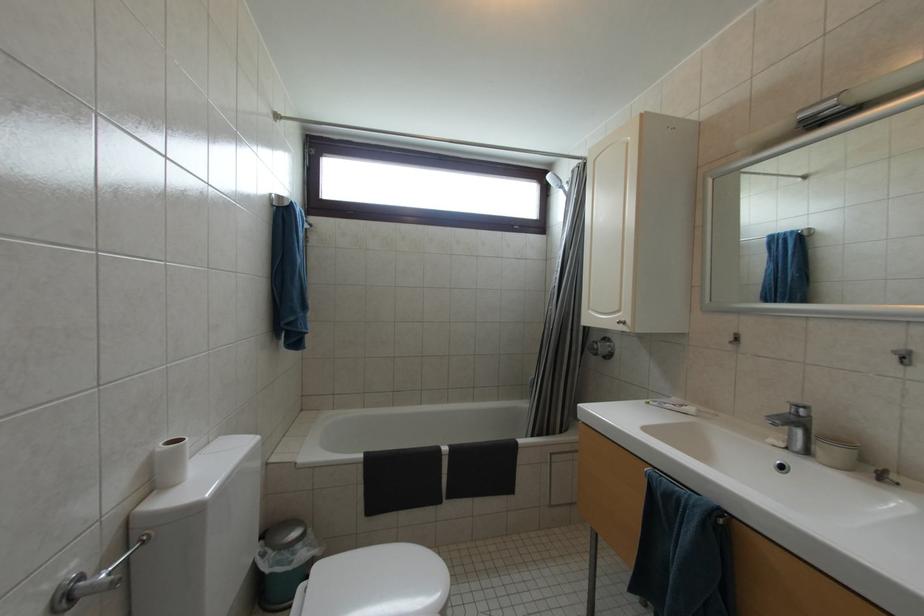
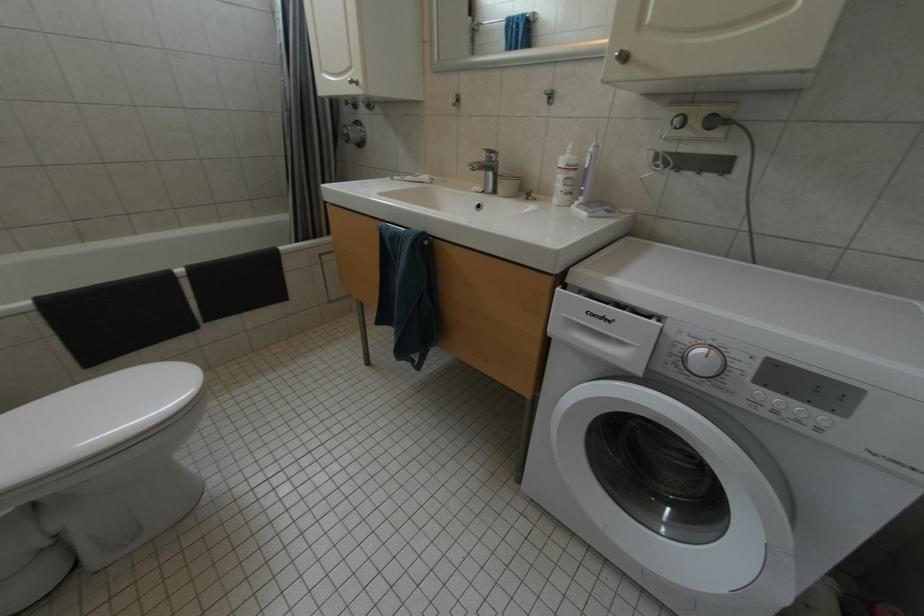
Based on the continuous images, in which direction is the camera rotating?

The rotation direction of the camera is right-down.